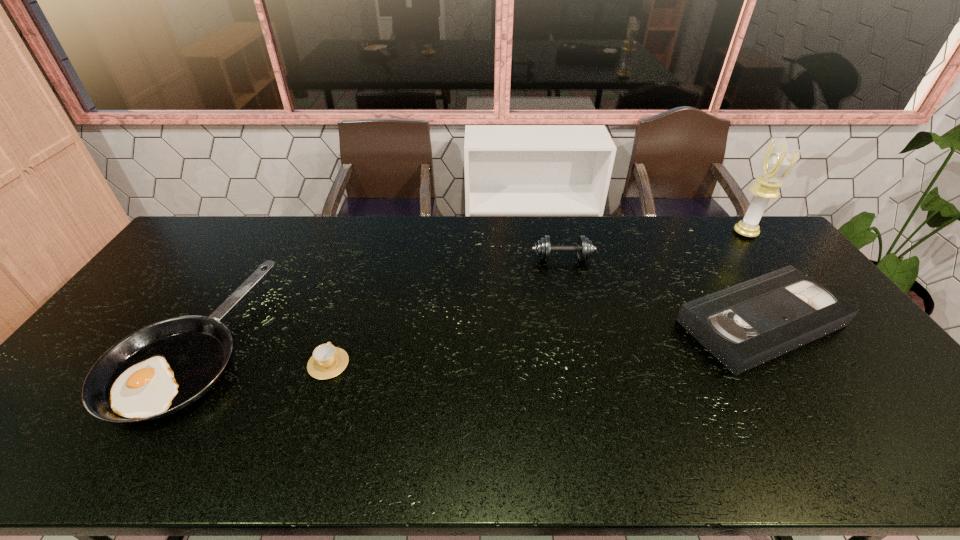
You are a GUI agent. You are given a task and a screenshot of the screen. Output one action in this format:
    pyautogui.click(x=<x>, y=<y>)
    Task: Click on the object at the left edge
    This screenshot has height=540, width=960.
    Given the screenshot: What is the action you would take?
    pyautogui.click(x=162, y=368)

Image resolution: width=960 pixels, height=540 pixels. I want to click on award that is at the right edge, so click(778, 162).

Where is `videotape that is at the right edge`? The image size is (960, 540). videotape that is at the right edge is located at coordinates coord(745,325).

Where is `object that is at the near left corner`? object that is at the near left corner is located at coordinates (162, 368).

This screenshot has width=960, height=540. I want to click on object located at the far right corner, so click(778, 162).

This screenshot has width=960, height=540. Identify the location of vacant area at the far edge. (461, 228).

Where is `free region at the near edge of the desktop`? This screenshot has height=540, width=960. free region at the near edge of the desktop is located at coordinates (796, 440).

Locate an element on the screen. The width and height of the screenshot is (960, 540). vacant area at the left edge is located at coordinates (116, 326).

What are the coordinates of `free space between the farthest object and the fourth tallest object` in the screenshot? It's located at (754, 278).

You are a GUI agent. You are given a task and a screenshot of the screen. Output one action in this format:
    pyautogui.click(x=<x>, y=<y>)
    Task: Click on the vacant area between the tallest object and the fourth object from right to left
    The width and height of the screenshot is (960, 540).
    Given the screenshot: What is the action you would take?
    pyautogui.click(x=537, y=298)